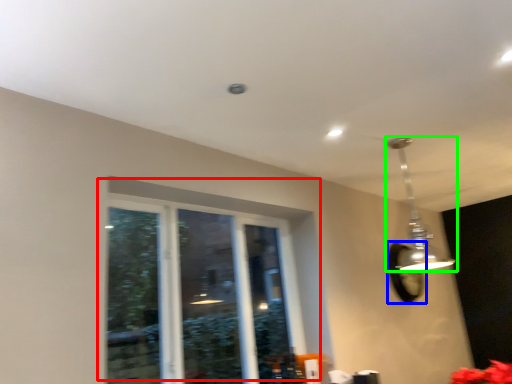
Question: Estimate the real-world distances between objects in this image. Which object is closer to window (highlighted by a red box), mirror (highlighted by a blue box) or lamp (highlighted by a green box)?

Choices:
 (A) mirror
 (B) lamp

Answer: (B)